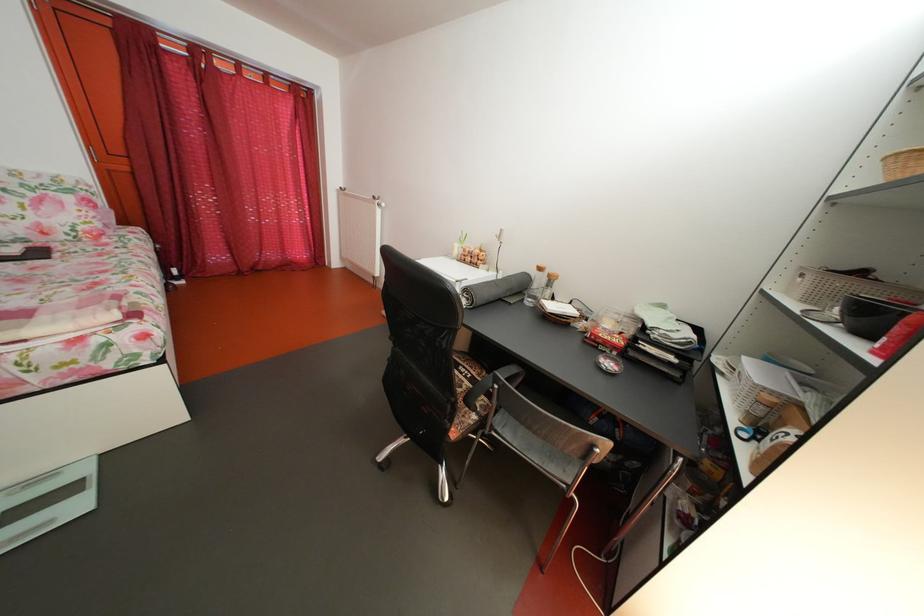
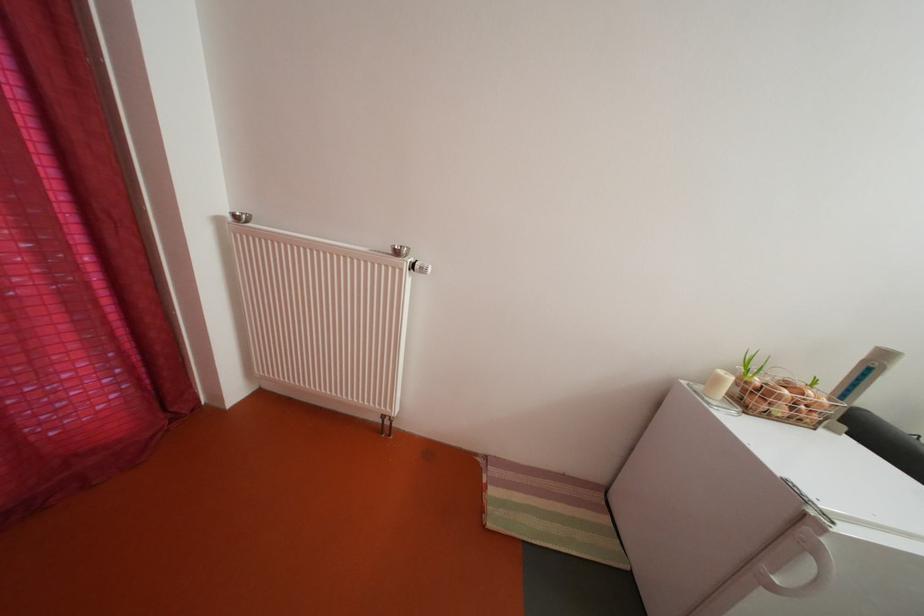
Locate, in the second image, the point that corresponds to (x=466, y=253) in the first image.

(728, 386)